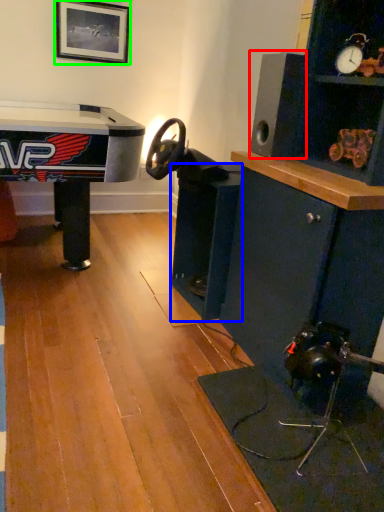
Question: Which is nearer to the speaker (highlighted by a red box)? shelf (highlighted by a blue box) or picture frame (highlighted by a green box).

Choices:
 (A) shelf
 (B) picture frame

Answer: (A)